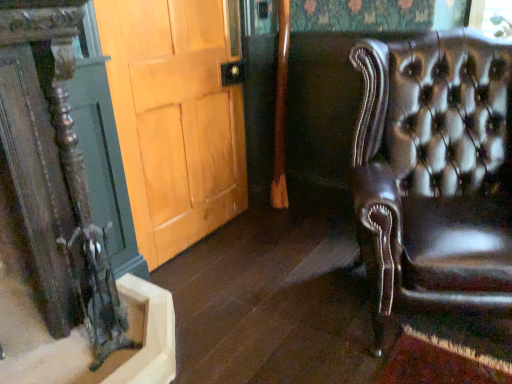
I want to click on free space above light brown wood door at center (from a real-world perspective), so click(x=175, y=0).